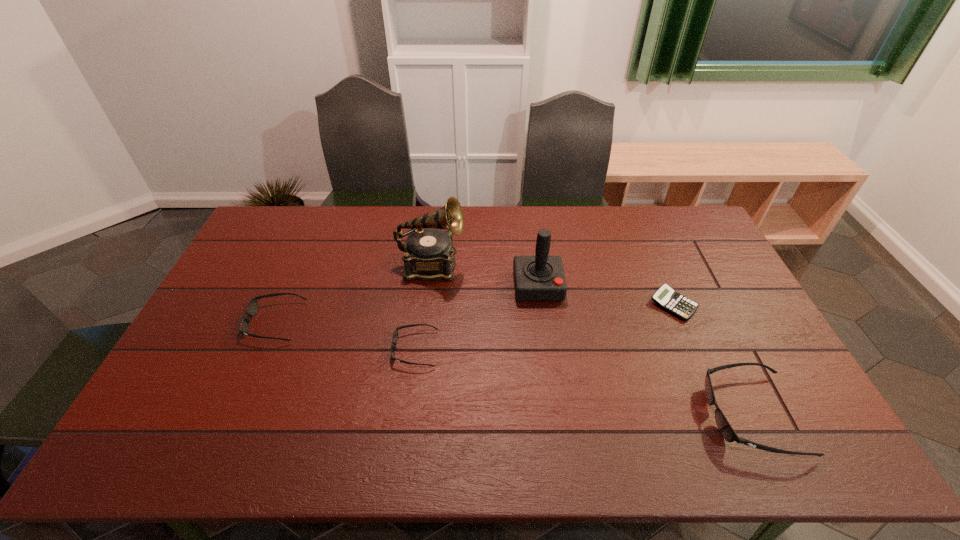
In order to click on vacant region located on the front of the calculator in this screenshot , I will do `click(692, 349)`.

Where is `blank space located 0.140m on the horn of the tallest object`? blank space located 0.140m on the horn of the tallest object is located at coordinates (507, 266).

Where is `object located in the near edge section of the desktop`? object located in the near edge section of the desktop is located at coordinates (726, 430).

The image size is (960, 540). Identify the location of object present at the left edge. (252, 308).

You are a GUI agent. You are given a task and a screenshot of the screen. Output one action in this format:
    pyautogui.click(x=<x>, y=<y>)
    Task: Click on the sunglasses that is at the right edge
    The width and height of the screenshot is (960, 540).
    Given the screenshot: What is the action you would take?
    pyautogui.click(x=726, y=430)

This screenshot has height=540, width=960. I want to click on calculator that is at the right edge, so click(665, 297).

Image resolution: width=960 pixels, height=540 pixels. Find the location of `object that is at the near right corner`. object that is at the near right corner is located at coordinates (x=726, y=430).

This screenshot has width=960, height=540. I want to click on free point at the far edge, so click(482, 218).

Find the location of a particular element. This screenshot has width=960, height=540. free space at the near edge of the desktop is located at coordinates point(232,403).

Identify the location of vacant point at the left edge. (200, 327).